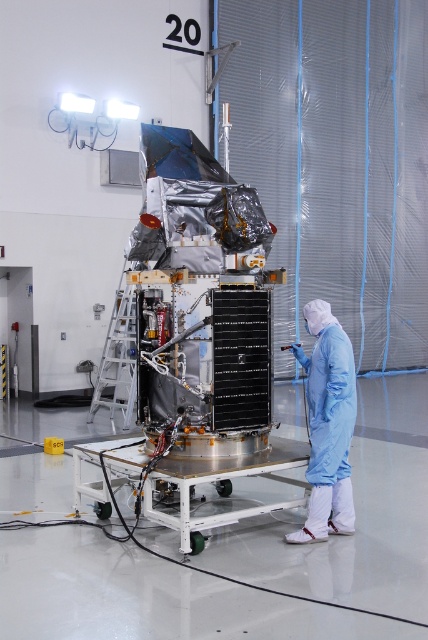
You are an engineer in the cleanroom. You need to move a tool from the silver reflective satellite at center to the blue smooth suit at center. In which direction should you move the tool?

The silver reflective satellite at center is to the left of the blue smooth suit at center, so you should move the tool to the right.

You are an engineer in the cleanroom and need to access the satellite. The silver reflective satellite at center and the blue smooth suit at center are both in your line of sight. Which object is closer to you?

The silver reflective satellite at center is closer to the viewer than the blue smooth suit at center, so the satellite is closer.